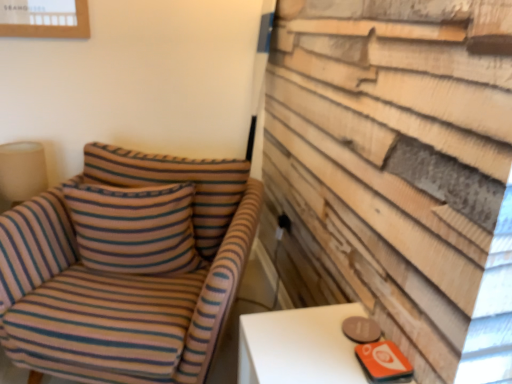
Question: Is black plastic outlet at center-right outside of beige fabric lampshade at left?

Choices:
 (A) yes
 (B) no

Answer: (A)

Question: Can you confirm if black plastic outlet at center-right is positioned to the left of beige fabric lampshade at left?

Choices:
 (A) yes
 (B) no

Answer: (B)

Question: Is black plastic outlet at center-right facing away from beige fabric lampshade at left?

Choices:
 (A) yes
 (B) no

Answer: (B)

Question: Is black plastic outlet at center-right taller than beige fabric lampshade at left?

Choices:
 (A) no
 (B) yes

Answer: (A)

Question: Is black plastic outlet at center-right bigger than beige fabric lampshade at left?

Choices:
 (A) no
 (B) yes

Answer: (A)

Question: Is point (35, 183) positioned closer to the camera than point (184, 241)?

Choices:
 (A) closer
 (B) farther

Answer: (B)

Question: Considering their positions, is beige fabric lampshade at left located in front of or behind striped fabric pillow at center?

Choices:
 (A) behind
 (B) front

Answer: (A)

Question: Looking at their shapes, would you say beige fabric lampshade at left is wider or thinner than striped fabric pillow at center?

Choices:
 (A) wide
 (B) thin

Answer: (B)

Question: Is beige fabric lampshade at left inside the boundaries of striped fabric pillow at center, or outside?

Choices:
 (A) inside
 (B) outside

Answer: (B)

Question: In the image, is beige fabric lampshade at left positioned in front of or behind striped fabric chair at left?

Choices:
 (A) behind
 (B) front

Answer: (A)

Question: From a real-world perspective, is beige fabric lampshade at left physically located above or below striped fabric chair at left?

Choices:
 (A) above
 (B) below

Answer: (A)

Question: Considering the positions of point (14, 200) and point (239, 264), is point (14, 200) closer or farther from the camera than point (239, 264)?

Choices:
 (A) farther
 (B) closer

Answer: (A)

Question: Is beige fabric lampshade at left inside the boundaries of striped fabric chair at left, or outside?

Choices:
 (A) inside
 (B) outside

Answer: (B)

Question: Is black plastic outlet at center-right wider or thinner than beige fabric lampshade at left?

Choices:
 (A) wide
 (B) thin

Answer: (B)

Question: Is point (284, 218) positioned closer to the camera than point (16, 200)?

Choices:
 (A) closer
 (B) farther

Answer: (B)